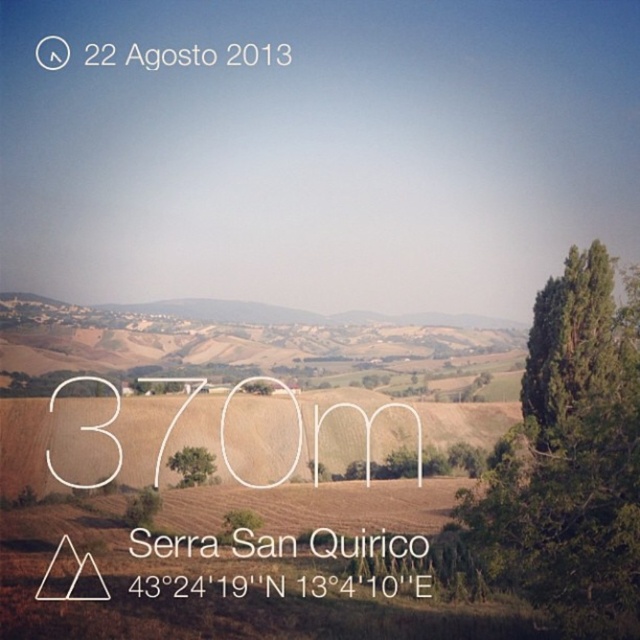
Question: Among these objects, which one is farthest from the camera?

Choices:
 (A) brown grassy hill at center
 (B) green leafy tree at right

Answer: (B)

Question: Does brown grassy hill at center appear over green leafy tree at center?

Choices:
 (A) yes
 (B) no

Answer: (A)

Question: Is green leafy tree at right to the right of brown grassy hill at center from the viewer's perspective?

Choices:
 (A) no
 (B) yes

Answer: (B)

Question: Can you confirm if green leafy tree at right is positioned above green leafy tree at center?

Choices:
 (A) no
 (B) yes

Answer: (B)

Question: Which of the following is the farthest from the observer?

Choices:
 (A) brown grassy hill at center
 (B) green leafy tree at center
 (C) green leafy tree at right

Answer: (C)

Question: Among these points, which one is nearest to the camera?

Choices:
 (A) (157, 316)
 (B) (529, 340)
 (C) (209, 481)

Answer: (C)